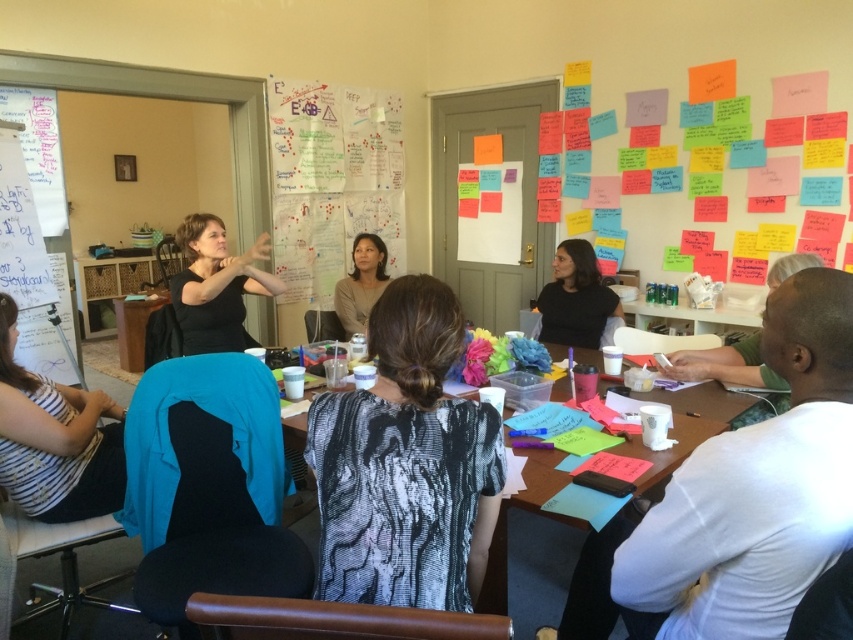
You are organizing a photo shoot and need to place a 18 inch wide prop between the white striped shirt at lower left and the matte black shirt at center. Can the prop fit between them?

The white striped shirt at lower left is wider than the matte black shirt at center. Therefore, the 18 inch wide prop may not fit between them if the space between the shirts is narrower than 18 inches. However, without knowing the exact distance between the shirts, it is impossible to determine if the prop will fit.

You are standing 1.5 meters away from the table. Can you reach the point at coordinates point (15, 433) on the table without moving closer?

The distance of point (15, 433) from viewer is 2.04 meters, so you are currently 1.5 meters away from the table. Since the point is further away than your current position, you cannot reach it without moving closer.